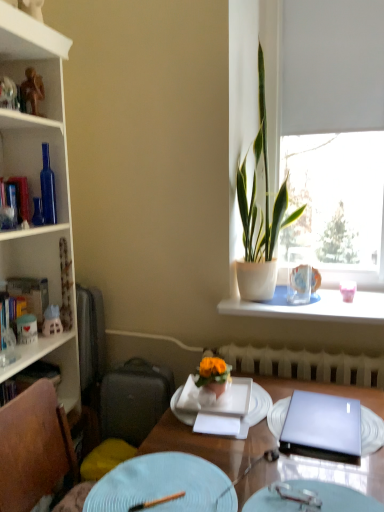
Question: Considering the positions of white plastic radiator at lower center and light blue textured plate at lower center, the 3th plate from the back, in the image, is white plastic radiator at lower center taller or shorter than light blue textured plate at lower center, the 3th plate from the back,?

Choices:
 (A) tall
 (B) short

Answer: (A)

Question: Relative to light blue textured plate at lower center, which appears as the first plate when viewed from the front, is white plastic radiator at lower center in front or behind?

Choices:
 (A) front
 (B) behind

Answer: (B)

Question: Considering the real-world distances, which object is farthest from the matte pink vase at window, the first tableware viewed from the back?

Choices:
 (A) gold metallic figurine at upper left
 (B) white ceramic vase at upper right
 (C) white matte window at upper right
 (D) light blue textured plate at lower center, which appears as the first plate when viewed from the front
 (E) satin purple laptop at center

Answer: (A)

Question: Estimate the real-world distances between objects in this image. Which object is closer to the metallic silver fork at center, the second tableware in the back-to-front sequence?

Choices:
 (A) hardcover book at left, placed as the 3th book when sorted from top to bottom
 (B) gold metallic figurine at upper left
 (C) green leafy plant at window
 (D) wooden table at center
 (E) hardcover book at left, which appears as the second book when viewed from the top

Answer: (D)